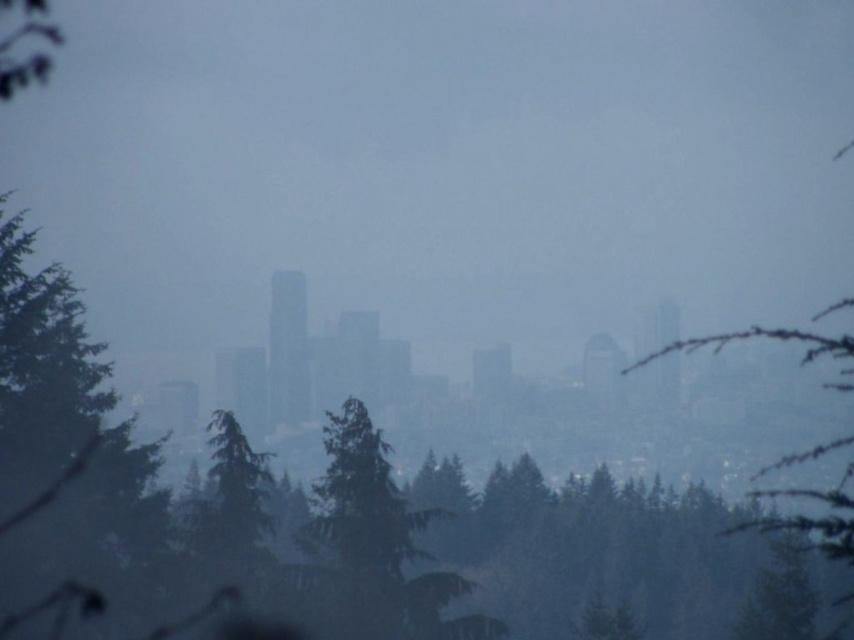
What do you see at coordinates (373, 545) in the screenshot?
I see `green textured tree at center` at bounding box center [373, 545].

Can you confirm if green textured tree at center is thinner than green matte tree at upper left?

Correct, green textured tree at center's width is less than green matte tree at upper left's.

The height and width of the screenshot is (640, 854). What are the coordinates of `green textured tree at center` in the screenshot? It's located at (373, 545).